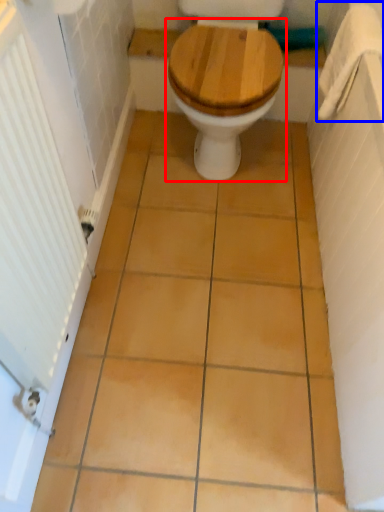
Question: Which object is further to the camera taking this photo, toilet (highlighted by a red box) or towel bar (highlighted by a blue box)?

Choices:
 (A) toilet
 (B) towel bar

Answer: (B)